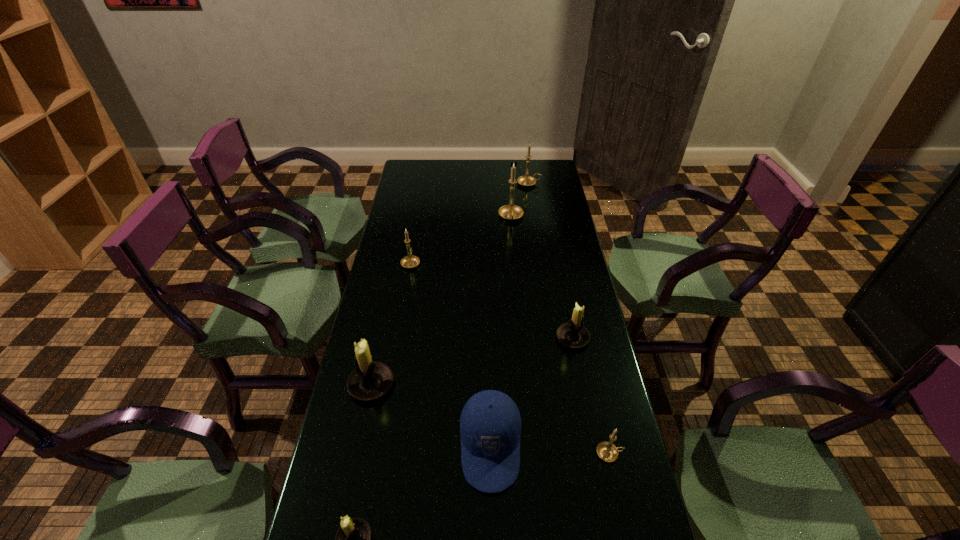
The width and height of the screenshot is (960, 540). What are the coordinates of `the tallest candle holder` in the screenshot? It's located at (510, 212).

At what (x,y) coordinates should I click in order to perform the action: click on the second farthest gold candle holder. Please return your answer as a coordinate pair (x, y). Looking at the image, I should click on pos(510,212).

The image size is (960, 540). What are the coordinates of `the second biggest gold candle holder` in the screenshot? It's located at (526, 180).

Identify the location of the farthest candle holder. The width and height of the screenshot is (960, 540). (526, 180).

The image size is (960, 540). I want to click on the fifth farthest candle holder, so click(x=370, y=380).

Image resolution: width=960 pixels, height=540 pixels. Identify the location of the fourth nearest object. (370, 380).

At what (x,y) coordinates should I click in order to perform the action: click on the third biggest gold candle holder. Please return your answer as a coordinate pair (x, y). The height and width of the screenshot is (540, 960). Looking at the image, I should click on (410, 261).

Where is `the third farthest gold candle holder`? This screenshot has width=960, height=540. the third farthest gold candle holder is located at coordinates (410, 261).

Where is `the second smallest white candle holder`? the second smallest white candle holder is located at coordinates (572, 334).

I want to click on the fourth nearest candle holder, so click(572, 334).